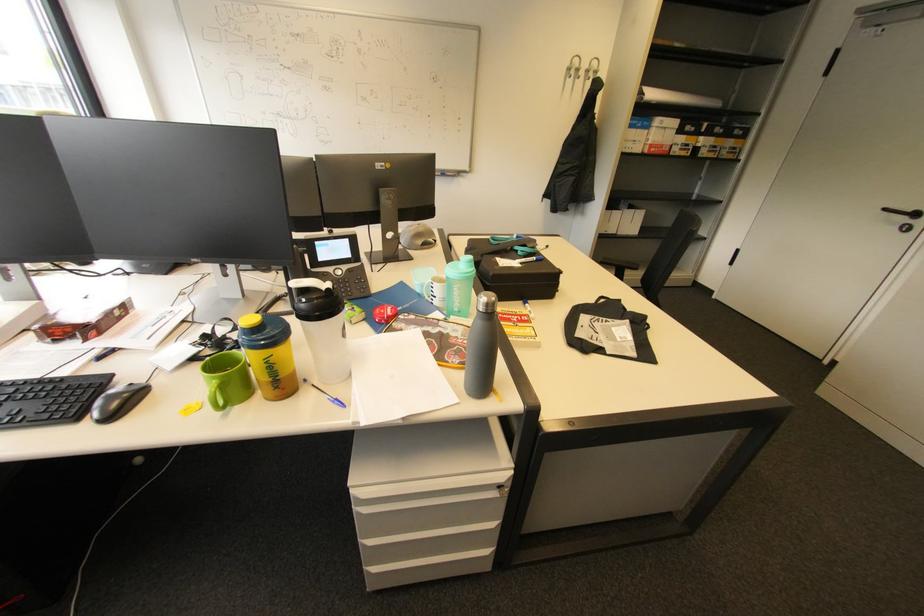
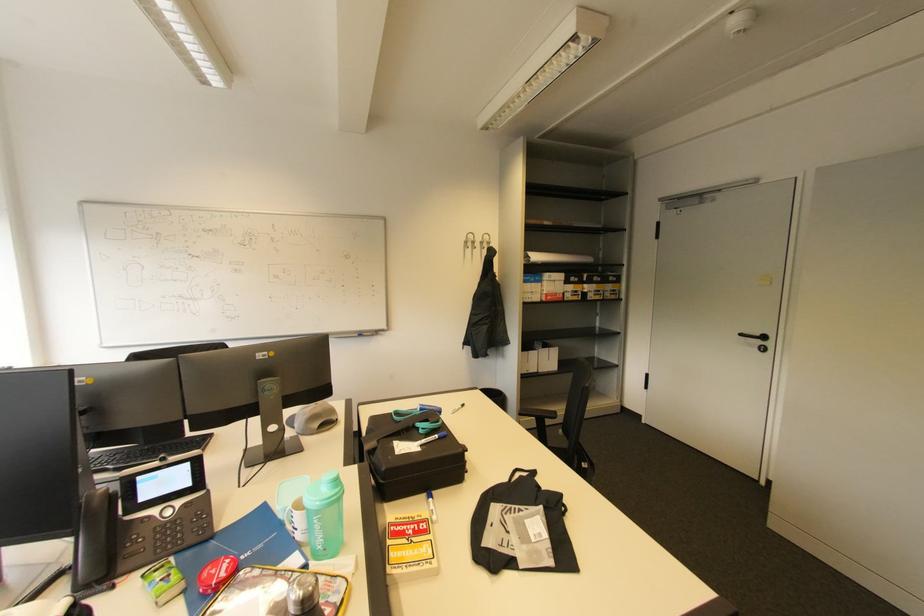
Question: What movement of the cameraman would produce the second image?

Choices:
 (A) Left
 (B) Right
 (C) Forward
 (D) Backward

Answer: (B)